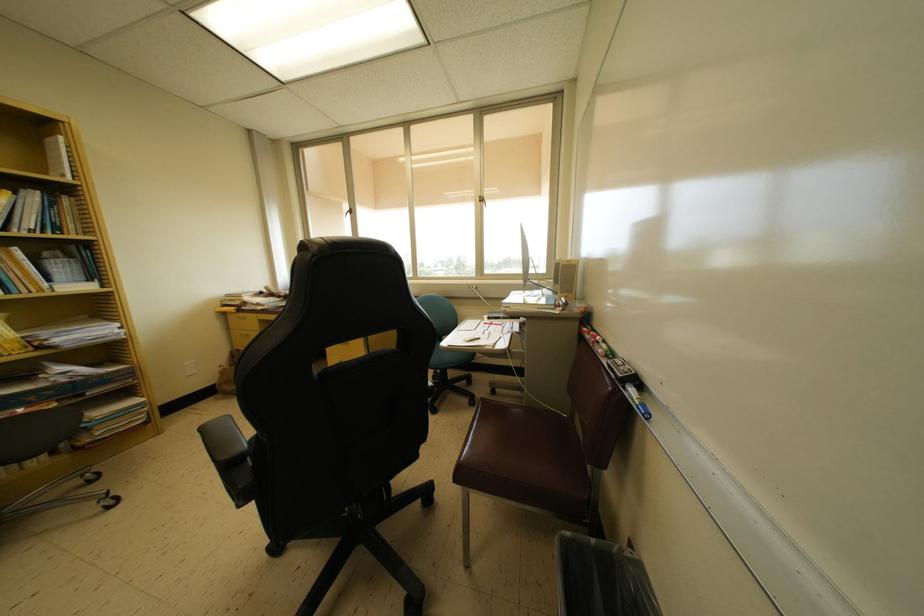
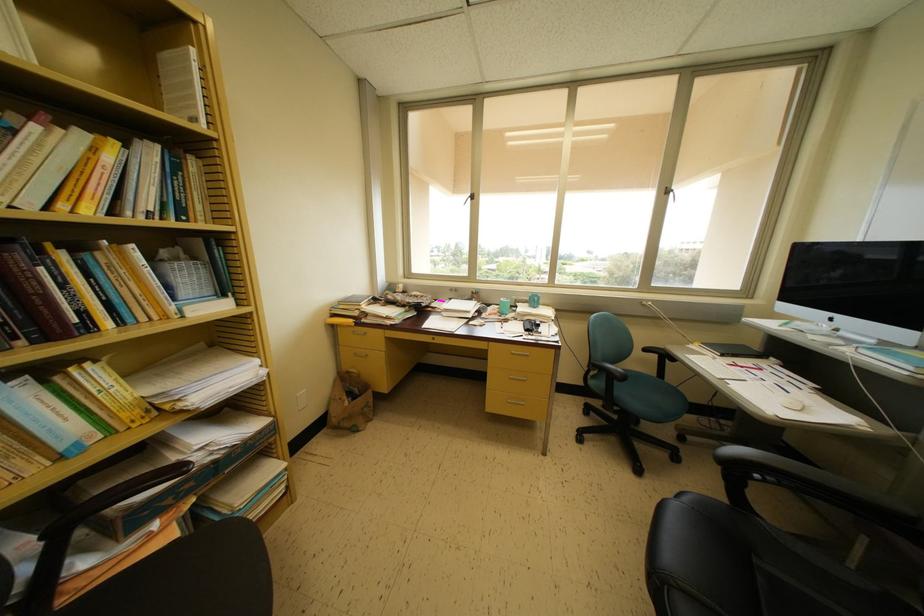
The point at (65, 143) is marked in the first image. Where is the corresponding point in the second image?

(197, 55)